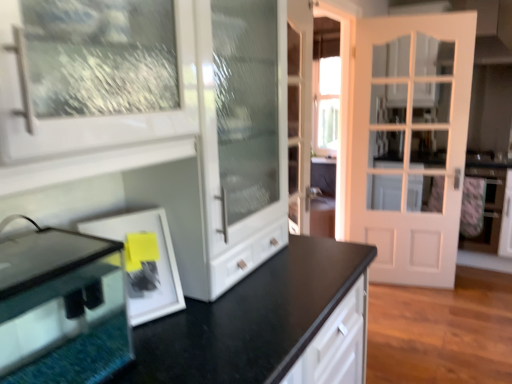
At what (x,y) coordinates should I click in order to perform the action: click on vacant region above clear glass fish tank at lower left (from a real-world perspective). Please return your answer as a coordinate pair (x, y). Looking at the image, I should click on (42, 260).